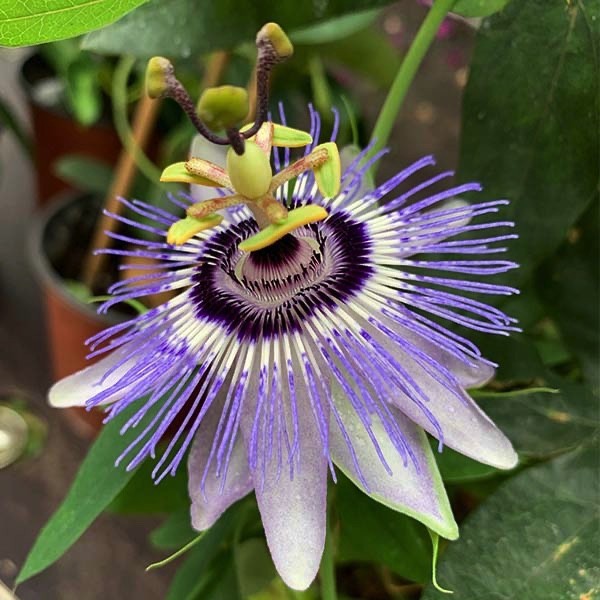
The height and width of the screenshot is (600, 600). I want to click on pot, so click(75, 342).